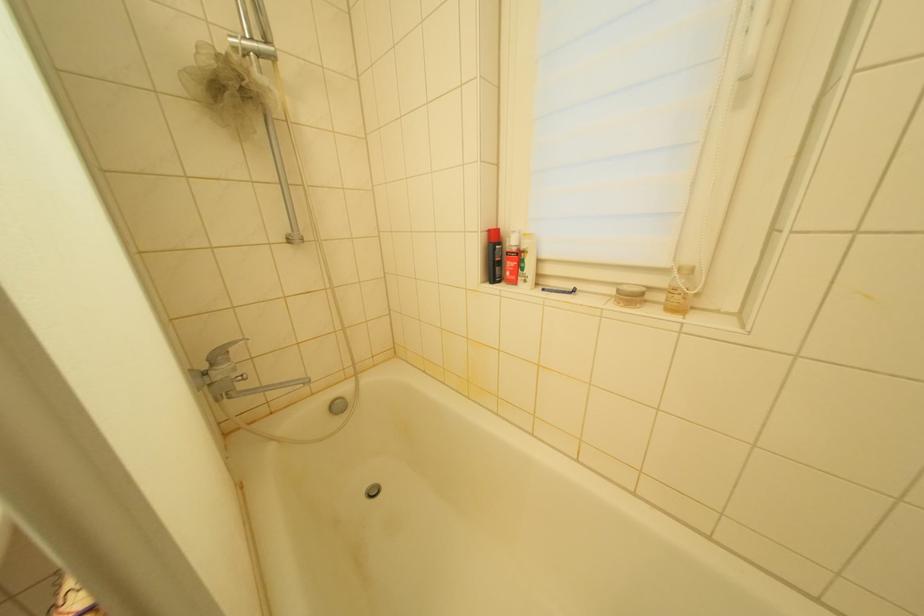
The width and height of the screenshot is (924, 616). What do you see at coordinates (337, 406) in the screenshot?
I see `the faucet diverter knob` at bounding box center [337, 406].